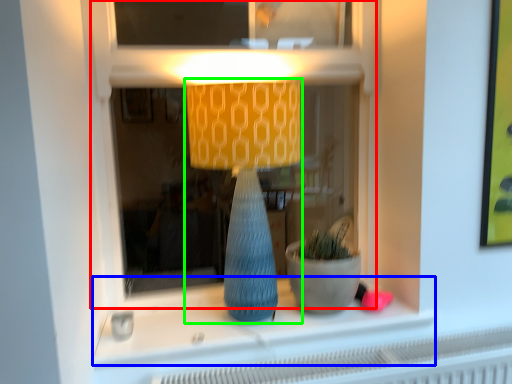
Question: Which object is positioned closest to shop window (highlighted by a red box)? Select from window sill (highlighted by a blue box) and lamp (highlighted by a green box).

Choices:
 (A) window sill
 (B) lamp

Answer: (B)